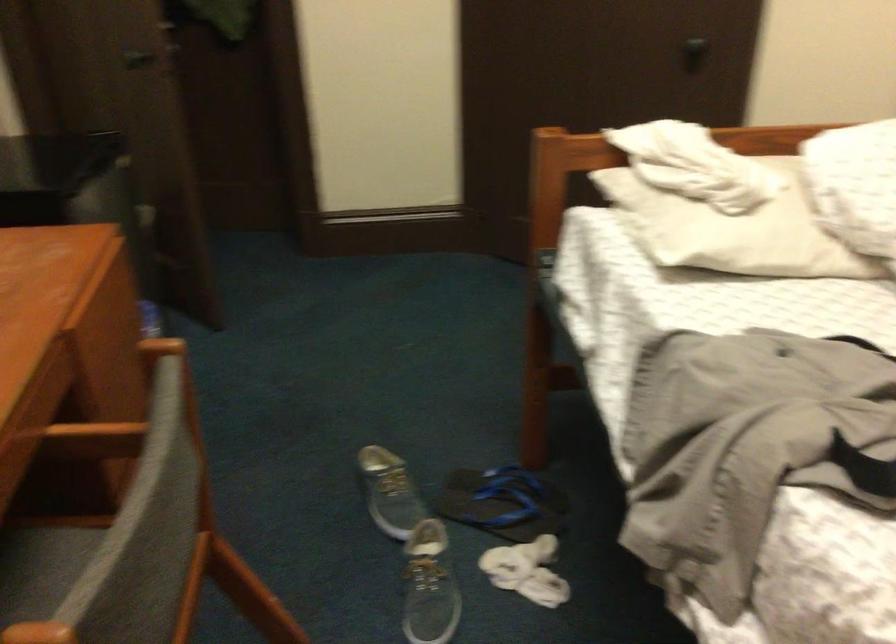
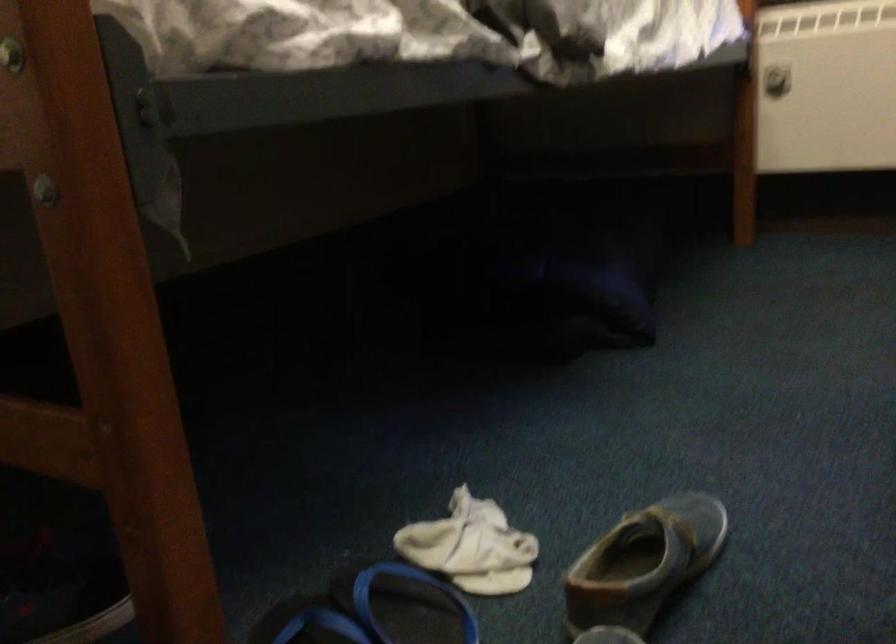
The point at (506, 524) is marked in the first image. Where is the corresponding point in the second image?

(406, 605)